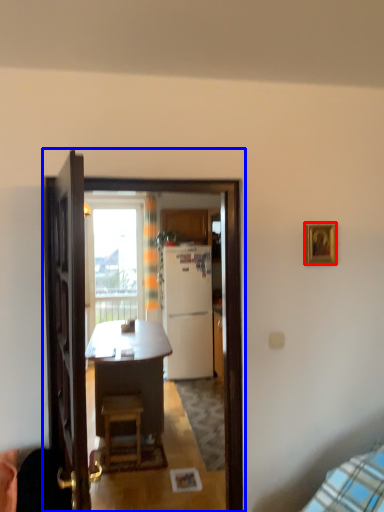
Question: Which object appears farthest to the camera in this image, picture frame (highlighted by a red box) or screen door (highlighted by a blue box)?

Choices:
 (A) picture frame
 (B) screen door

Answer: (A)